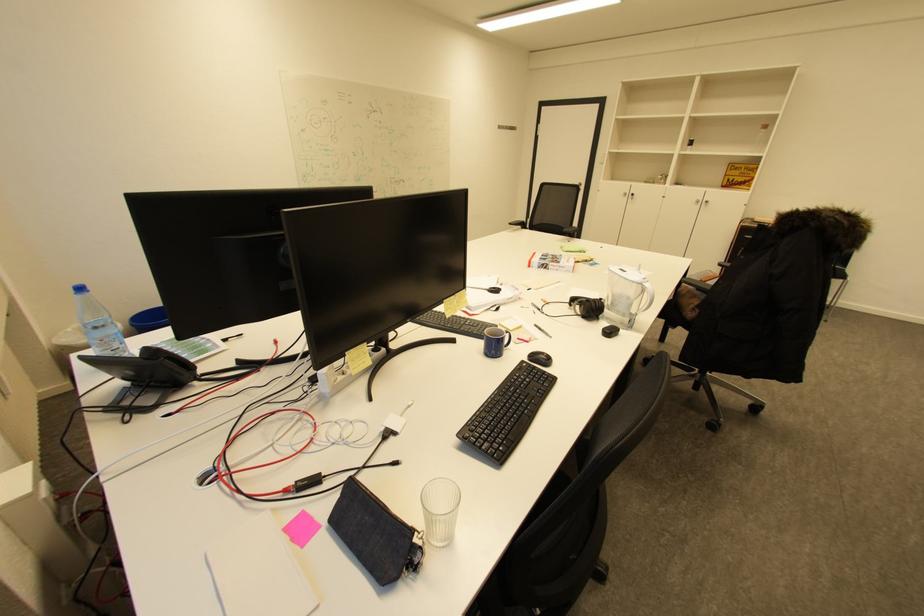
At what (x,y) coordinates should I click in order to perform the action: click on black phone handset. Please return your answer as a coordinate pair (x, y). Looking at the image, I should click on (169, 360).